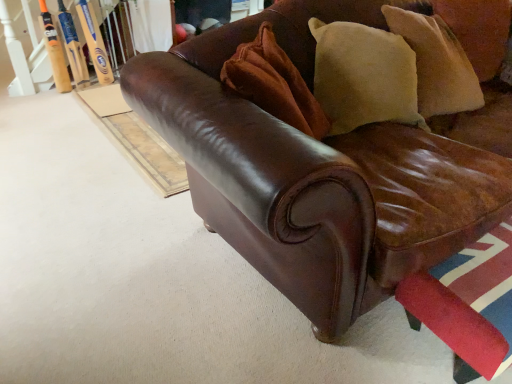
Question: Would you say orange wood baseball bat at upper left, the first baseball bat when ordered from left to right, is outside brown leather couch at center?

Choices:
 (A) yes
 (B) no

Answer: (A)

Question: Does orange wood baseball bat at upper left, the 2th baseball bat from the right, have a greater height compared to brown leather couch at center?

Choices:
 (A) no
 (B) yes

Answer: (A)

Question: Is the depth of orange wood baseball bat at upper left, the 2th baseball bat from the right, greater than that of brown leather couch at center?

Choices:
 (A) yes
 (B) no

Answer: (A)

Question: Is there a large distance between orange wood baseball bat at upper left, the first baseball bat when ordered from left to right, and brown leather couch at center?

Choices:
 (A) yes
 (B) no

Answer: (A)

Question: Considering the relative sizes of orange wood baseball bat at upper left, the 2th baseball bat from the right, and brown leather couch at center in the image provided, is orange wood baseball bat at upper left, the 2th baseball bat from the right, thinner than brown leather couch at center?

Choices:
 (A) yes
 (B) no

Answer: (A)

Question: From the image's perspective, is orange wood baseball bat at upper left, the first baseball bat when ordered from left to right, on top of brown leather couch at center?

Choices:
 (A) yes
 (B) no

Answer: (A)

Question: Is velvet beige pillow at upper right, marked as the second pillow in a right-to-left arrangement, far from orange wood baseball bat at upper left, the 2th baseball bat from the right?

Choices:
 (A) yes
 (B) no

Answer: (A)

Question: From a real-world perspective, does velvet beige pillow at upper right, arranged as the 1th pillow when viewed from the left, stand above orange wood baseball bat at upper left, the first baseball bat when ordered from left to right?

Choices:
 (A) yes
 (B) no

Answer: (A)

Question: Does velvet beige pillow at upper right, marked as the second pillow in a right-to-left arrangement, contain orange wood baseball bat at upper left, the 2th baseball bat from the right?

Choices:
 (A) no
 (B) yes

Answer: (A)

Question: Is velvet beige pillow at upper right, placed as the second pillow when sorted from back to front, at the right side of orange wood baseball bat at upper left, the first baseball bat when ordered from left to right?

Choices:
 (A) yes
 (B) no

Answer: (A)

Question: From the image's perspective, is velvet beige pillow at upper right, the 1th pillow when ordered from front to back, over orange wood baseball bat at upper left, the 2th baseball bat from the right?

Choices:
 (A) yes
 (B) no

Answer: (B)

Question: Is velvet beige pillow at upper right, the 1th pillow when ordered from front to back, smaller than orange wood baseball bat at upper left, the 2th baseball bat from the right?

Choices:
 (A) no
 (B) yes

Answer: (A)

Question: Is beige suede pillow at upper right, which ranks as the 2th pillow in front-to-back order, at the right side of orange wood baseball bat at upper left, the 2th baseball bat from the right?

Choices:
 (A) no
 (B) yes

Answer: (B)